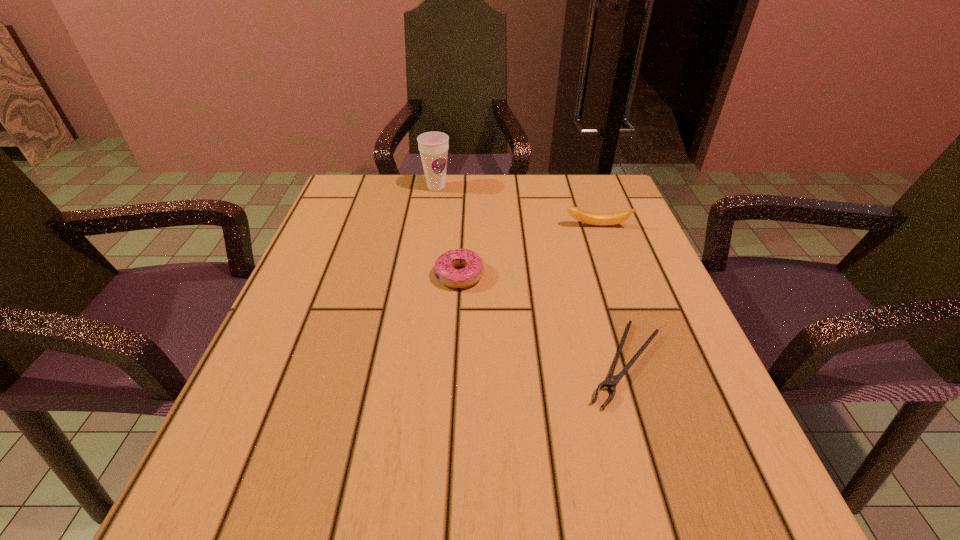
In order to click on free point at the right edge in this screenshot , I will do `click(634, 284)`.

Find the location of a particular element. free space at the far left corner of the desktop is located at coordinates click(x=383, y=195).

The width and height of the screenshot is (960, 540). In the image, there is a desktop. Find the location of `free space at the far right corner`. free space at the far right corner is located at coordinates (579, 190).

At what (x,y) coordinates should I click in order to perform the action: click on empty space between the farthest object and the shortest object. Please return your answer as a coordinate pair (x, y). This screenshot has width=960, height=540. Looking at the image, I should click on (531, 275).

You are a GUI agent. You are given a task and a screenshot of the screen. Output one action in this format:
    pyautogui.click(x=<x>, y=<y>)
    Task: Click on the unoccupied position between the second shortest object and the second tallest object
    
    Given the screenshot: What is the action you would take?
    pyautogui.click(x=528, y=251)

The image size is (960, 540). I want to click on vacant space in between the tallest object and the tongs, so click(x=531, y=275).

You are a GUI agent. You are given a task and a screenshot of the screen. Output one action in this format:
    pyautogui.click(x=<x>, y=<y>)
    Task: Click on the free point between the third tallest object and the farthest object
    This screenshot has height=540, width=960.
    Given the screenshot: What is the action you would take?
    (448, 232)

I want to click on free point between the farthest object and the second nearest object, so click(x=448, y=232).

Identify the location of vacant space that is in between the third farthest object and the shortest object. The image size is (960, 540). (542, 319).

In order to click on vacant space in between the tongs and the third tallest object in this screenshot , I will do 542,319.